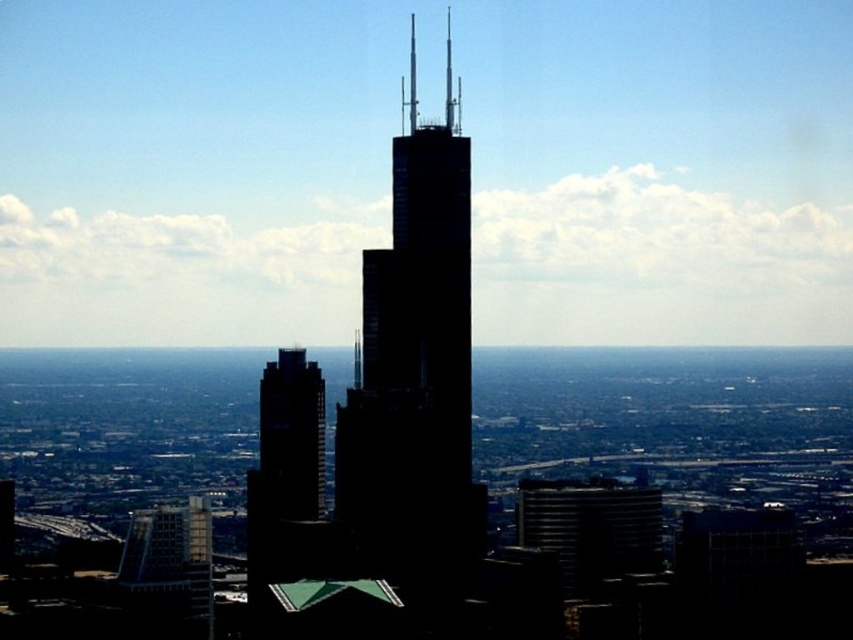
Question: Which point is farther to the camera?

Choices:
 (A) [380, 440]
 (B) [317, 368]

Answer: (A)

Question: Can you confirm if black glass skyscraper at center is positioned below smooth glass skyscraper at center?

Choices:
 (A) no
 (B) yes

Answer: (A)

Question: Is black glass skyscraper at center closer to the viewer compared to smooth glass skyscraper at center?

Choices:
 (A) no
 (B) yes

Answer: (B)

Question: Among these points, which one is farthest from the camera?

Choices:
 (A) (459, 388)
 (B) (280, 504)

Answer: (B)

Question: Is black glass skyscraper at center to the left of smooth glass skyscraper at center from the viewer's perspective?

Choices:
 (A) yes
 (B) no

Answer: (B)